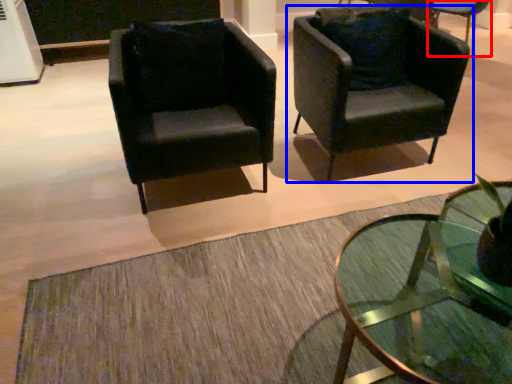
Question: Which object appears farthest to the camera in this image, chair (highlighted by a red box) or chair (highlighted by a blue box)?

Choices:
 (A) chair
 (B) chair

Answer: (A)